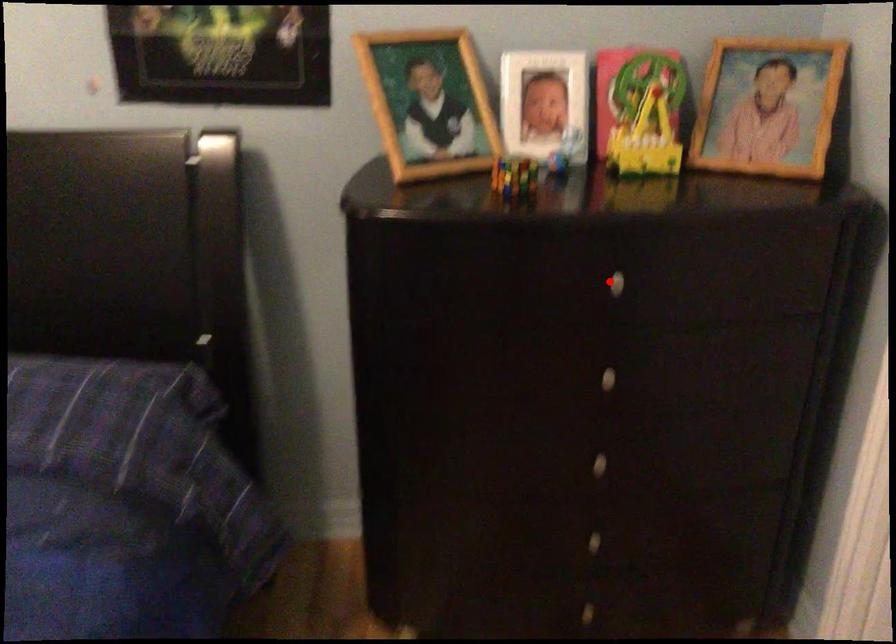
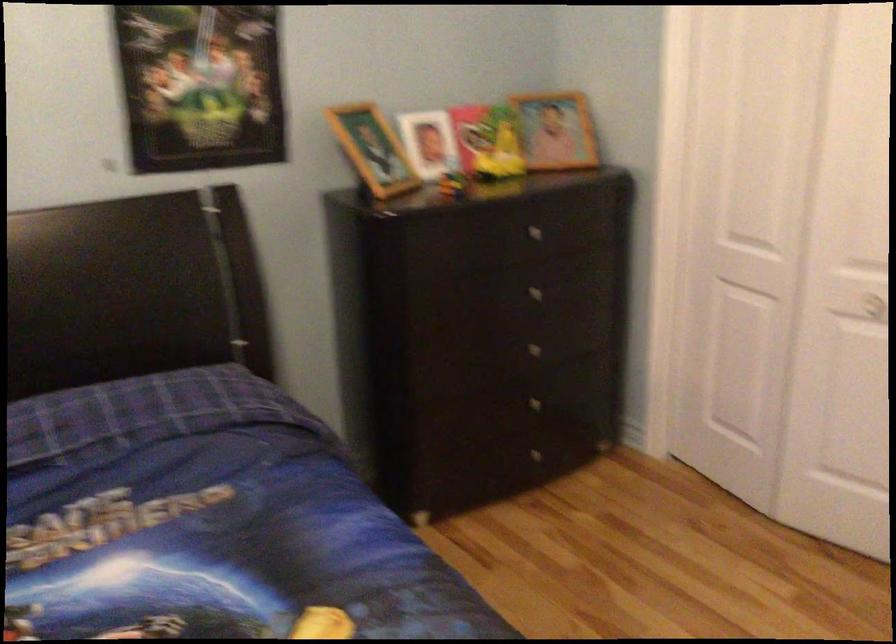
Find the pixel in the second image that matches the highlighted location in the first image.

(530, 230)